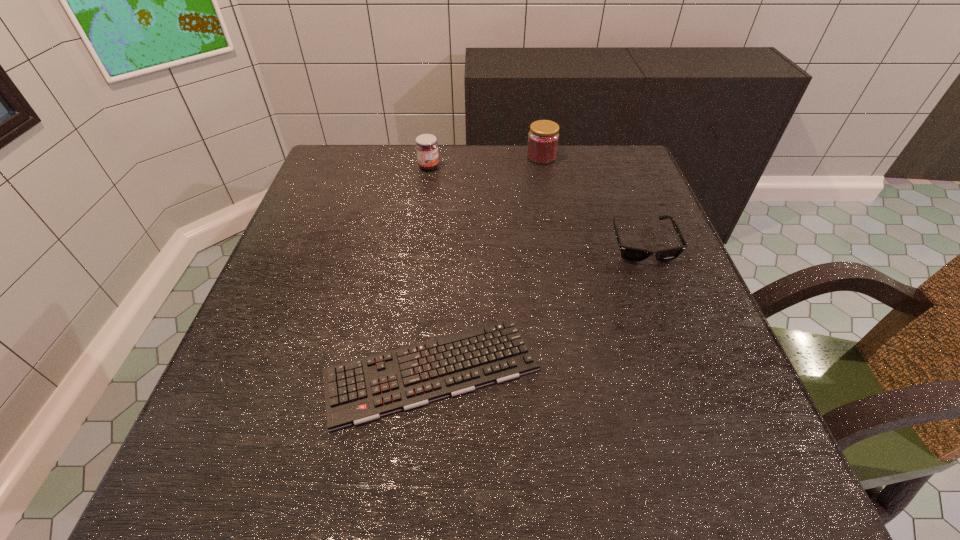
The image size is (960, 540). In order to click on object present at the left edge in this screenshot , I will do `click(361, 390)`.

In order to click on object that is positioned at the right edge in this screenshot , I will do `click(632, 254)`.

Image resolution: width=960 pixels, height=540 pixels. What are the coordinates of `free point at the far edge` in the screenshot? It's located at (381, 195).

Image resolution: width=960 pixels, height=540 pixels. I want to click on free location at the near edge of the desktop, so click(669, 503).

Locate an element on the screen. vacant area at the left edge of the desktop is located at coordinates (309, 409).

Identify the location of free space at the right edge of the desktop. This screenshot has height=540, width=960. (624, 311).

In the image, there is a desktop. At what (x,y) coordinates should I click in order to perform the action: click on blank space at the far left corner. Please return your answer as a coordinate pair (x, y). Looking at the image, I should click on (373, 191).

Locate an element on the screen. The height and width of the screenshot is (540, 960). vacant space at the far right corner is located at coordinates (589, 152).

Locate an element on the screen. unoccupied area between the second nearest object and the computer keyboard is located at coordinates (537, 307).

You are a GUI agent. You are given a task and a screenshot of the screen. Output one action in this format:
    pyautogui.click(x=<x>, y=<y>)
    Task: Click on the unoccupied position between the left jam and the right jam
    The width and height of the screenshot is (960, 540).
    Given the screenshot: What is the action you would take?
    pyautogui.click(x=485, y=162)